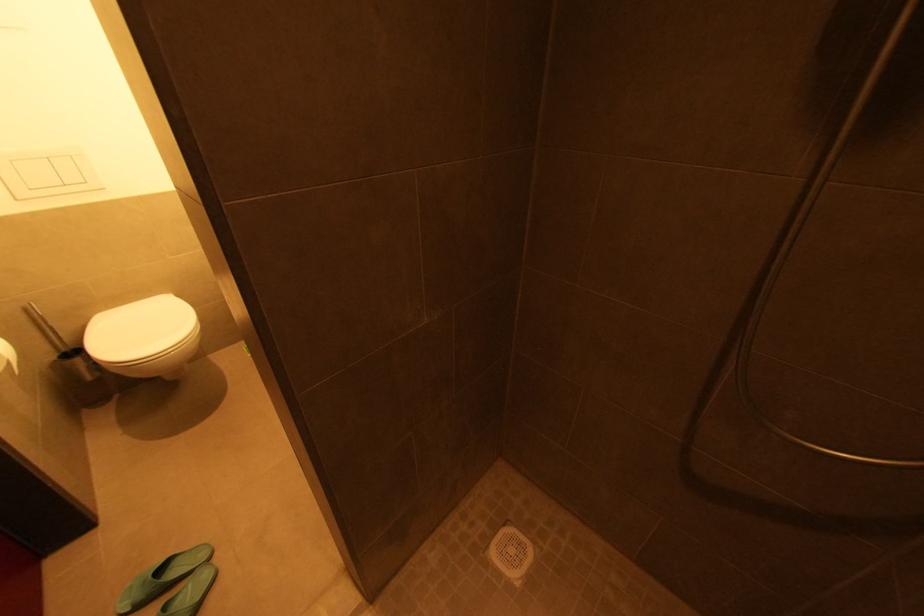
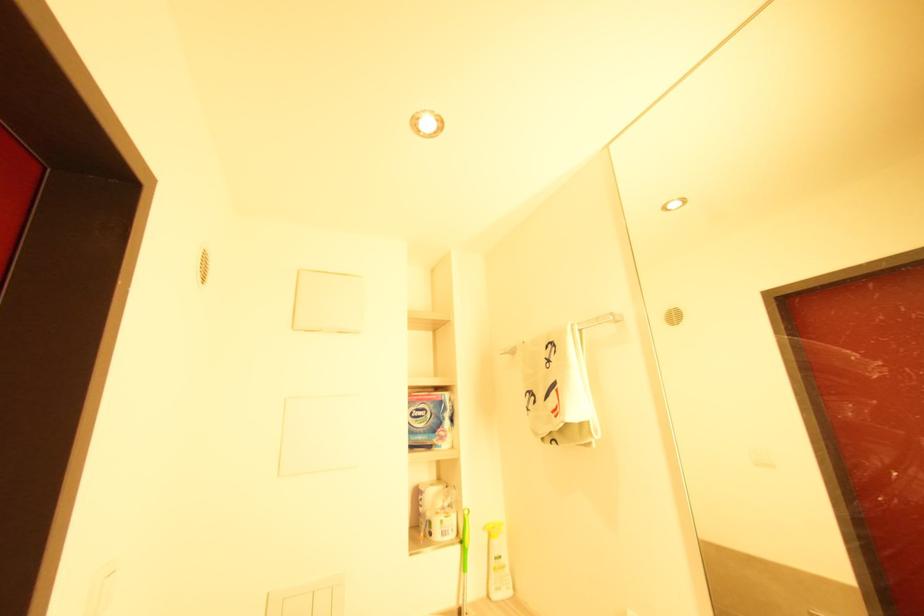
How did the camera likely rotate?

The camera rotated toward left-up.